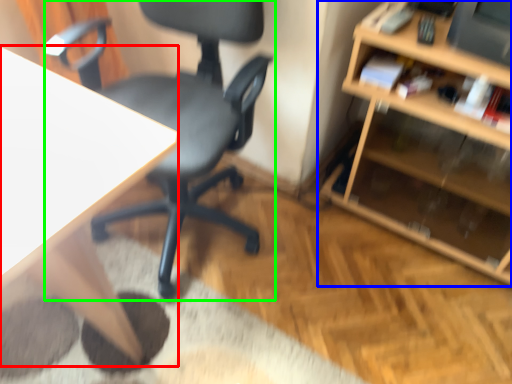
Question: Which object is positioned closest to desk (highlighted by a red box)? Select from shelf (highlighted by a blue box) and chair (highlighted by a green box).

Choices:
 (A) shelf
 (B) chair

Answer: (B)